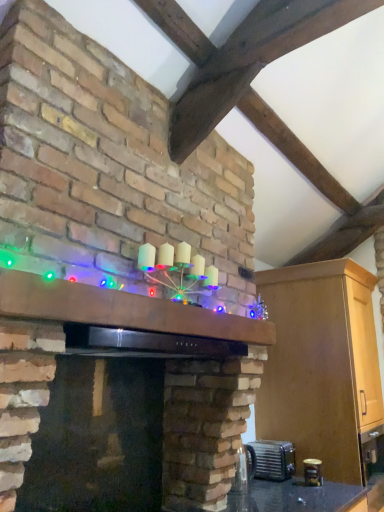
Question: From a real-world perspective, is metallic silver toaster at lower right, which is the 1th appliance in right-to-left order, beneath illuminated wooden mantle at center?

Choices:
 (A) yes
 (B) no

Answer: (A)

Question: Does metallic silver toaster at lower right, which is the 1th appliance in right-to-left order, have a lesser height compared to illuminated wooden mantle at center?

Choices:
 (A) yes
 (B) no

Answer: (B)

Question: Is metallic silver toaster at lower right, which is the 1th appliance in right-to-left order, at the left side of illuminated wooden mantle at center?

Choices:
 (A) yes
 (B) no

Answer: (B)

Question: From a real-world perspective, is metallic silver toaster at lower right, the 2th appliance viewed from the left, located higher than illuminated wooden mantle at center?

Choices:
 (A) yes
 (B) no

Answer: (B)

Question: Does metallic silver toaster at lower right, the 2th appliance viewed from the left, lie behind illuminated wooden mantle at center?

Choices:
 (A) yes
 (B) no

Answer: (A)

Question: Is matte brick fireplace at center in front of or behind illuminated wooden mantle at center in the image?

Choices:
 (A) front
 (B) behind

Answer: (A)

Question: Considering the positions of matte brick fireplace at center and illuminated wooden mantle at center in the image, is matte brick fireplace at center bigger or smaller than illuminated wooden mantle at center?

Choices:
 (A) big
 (B) small

Answer: (A)

Question: Choose the correct answer: Is matte brick fireplace at center inside illuminated wooden mantle at center or outside it?

Choices:
 (A) inside
 (B) outside

Answer: (B)

Question: Looking at their shapes, would you say matte brick fireplace at center is wider or thinner than illuminated wooden mantle at center?

Choices:
 (A) thin
 (B) wide

Answer: (B)

Question: Would you say matte black exhaust hood at upper center is to the left or to the right of matte brick fireplace at center in the picture?

Choices:
 (A) right
 (B) left

Answer: (A)

Question: From their relative heights in the image, would you say matte black exhaust hood at upper center is taller or shorter than matte brick fireplace at center?

Choices:
 (A) tall
 (B) short

Answer: (B)

Question: From a real-world perspective, is matte black exhaust hood at upper center above or below matte brick fireplace at center?

Choices:
 (A) above
 (B) below

Answer: (A)

Question: In terms of width, does matte black exhaust hood at upper center look wider or thinner when compared to matte brick fireplace at center?

Choices:
 (A) thin
 (B) wide

Answer: (A)

Question: Considering their positions, is metallic silver toaster at lower right, the 2th appliance viewed from the left, located in front of or behind metallic silver toaster at lower right, the second appliance in the right-to-left sequence?

Choices:
 (A) behind
 (B) front

Answer: (A)

Question: Visually, is metallic silver toaster at lower right, placed as the 1th appliance when sorted from back to front, positioned to the left or to the right of metallic silver toaster at lower right, the second appliance in the right-to-left sequence?

Choices:
 (A) left
 (B) right

Answer: (B)